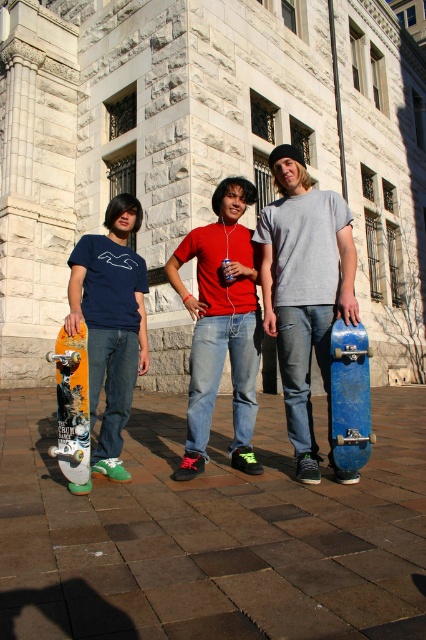
Can you confirm if matte black skateboard at center is positioned below orange matte skateboard at left?

Actually, matte black skateboard at center is above orange matte skateboard at left.

Between matte black skateboard at center and orange matte skateboard at left, which one has less height?

orange matte skateboard at left

Who is more distant from viewer, (245, 280) or (81, 332)?

Point (245, 280)

Locate an element on the screen. The height and width of the screenshot is (640, 426). matte black skateboard at center is located at coordinates (221, 324).

Does matte black skateboard at center have a smaller size compared to matte yellow skateboard at left?

Actually, matte black skateboard at center might be larger than matte yellow skateboard at left.

Does matte black skateboard at center lie behind matte yellow skateboard at left?

Yes, it is behind matte yellow skateboard at left.

Between point (218, 269) and point (117, 440), which one is positioned in front?

Point (117, 440)

The height and width of the screenshot is (640, 426). What are the coordinates of `matte black skateboard at center` in the screenshot? It's located at (221, 324).

Between ripped denim jeans at center and matte yellow skateboard at left, which one appears on the right side from the viewer's perspective?

From the viewer's perspective, ripped denim jeans at center appears more on the right side.

Who is shorter, ripped denim jeans at center or matte yellow skateboard at left?

With less height is matte yellow skateboard at left.

Locate an element on the screen. This screenshot has width=426, height=640. ripped denim jeans at center is located at coordinates (304, 289).